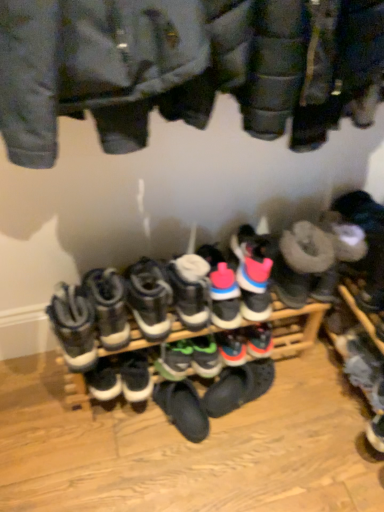
Question: From a real-world perspective, relative to black suede sneaker at center, the seventh footwear when ordered from right to left, is white suede sneakers at center, placed as the sixth footwear when sorted from left to right, vertically above or below?

Choices:
 (A) below
 (B) above

Answer: (B)

Question: Is white suede sneakers at center, acting as the fourth footwear starting from the right, to the left or to the right of black suede sneaker at center, marked as the third footwear in a left-to-right arrangement, in the image?

Choices:
 (A) left
 (B) right

Answer: (B)

Question: Estimate the real-world distances between objects in this image. Which object is farther from the black suede sneaker at center, marked as the third footwear in a left-to-right arrangement?

Choices:
 (A) white suede sneakers at center, acting as the fourth footwear starting from the right
 (B) rubberized black shoes at center
 (C) white leather sneakers at center, which appears as the 9th footwear when viewed from the right
 (D) green suede sneakers at center, the fifth footwear positioned from the right
 (E) leather sneakers at center, arranged as the 6th footwear when viewed from the right

Answer: (A)

Question: Which object is positioned closest to the white leather sneakers at center, which appears as the 9th footwear when viewed from the right?

Choices:
 (A) white suede sneakers at center, acting as the fourth footwear starting from the right
 (B) leather sneakers at center, the 4th footwear in the left-to-right sequence
 (C) black suede sneaker at center, the seventh footwear when ordered from right to left
 (D) pink suede sneakers at center, which ranks as the 3th footwear in right-to-left order
 (E) white leather sneakers at center, which is the eighth footwear in right-to-left order

Answer: (E)